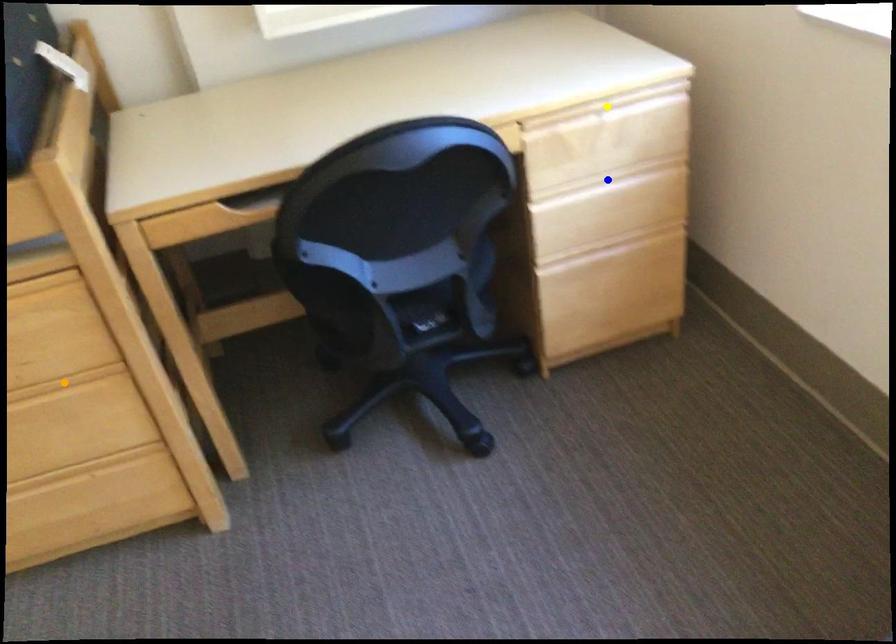
In the scene shown: Order these from nearest to farthest:
orange point, yellow point, blue point

orange point → yellow point → blue point